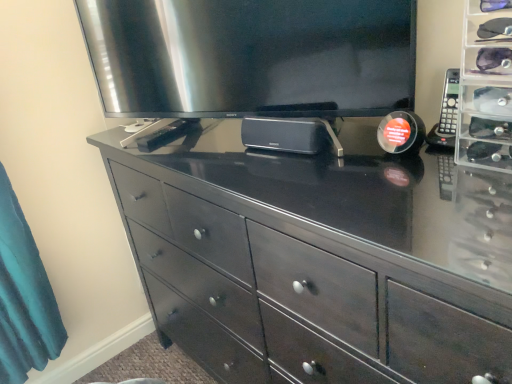
In order to click on vacant area that is in front of satin silver television at upper center in this screenshot , I will do `click(306, 190)`.